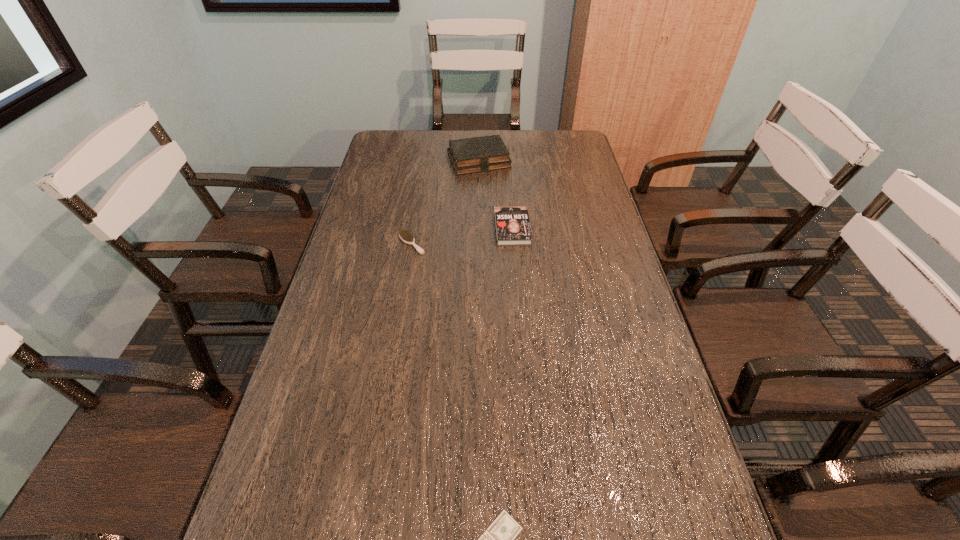
This screenshot has height=540, width=960. Find the location of `the farthest object`. the farthest object is located at coordinates (477, 154).

This screenshot has width=960, height=540. I want to click on the tallest object, so click(x=477, y=154).

You are a GUI agent. You are given a task and a screenshot of the screen. Output one action in this format:
    pyautogui.click(x=<x>, y=<y>)
    Task: Click on the shorter book
    This screenshot has width=960, height=540.
    Given the screenshot: What is the action you would take?
    pyautogui.click(x=512, y=224)

Find the location of `scrubbing brush`. scrubbing brush is located at coordinates (406, 236).

Locate an element on the screen. free space located 0.120m on the right of the tallest object is located at coordinates (542, 160).

Find the location of a particular element. This screenshot has height=540, width=960. blank area located 0.140m on the back of the shorter book is located at coordinates (509, 188).

Find the location of a particular element. free space located 0.310m on the back of the scrubbing brush is located at coordinates (422, 179).

In order to click on object that is at the far edge in this screenshot , I will do `click(477, 154)`.

The width and height of the screenshot is (960, 540). Find the location of `vacant region at the far edge of the desktop`. vacant region at the far edge of the desktop is located at coordinates (527, 139).

Where is `free space at the left edge`? free space at the left edge is located at coordinates (334, 533).